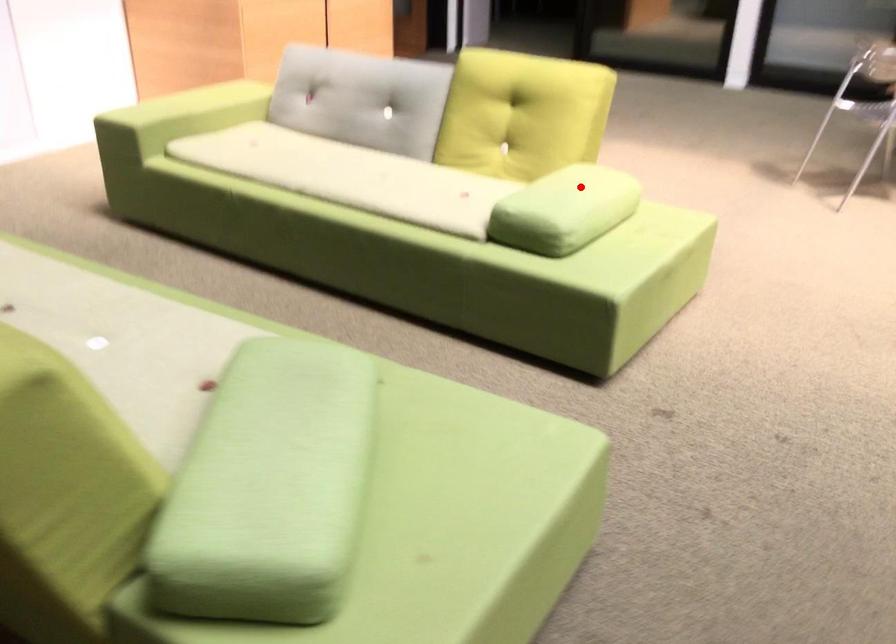
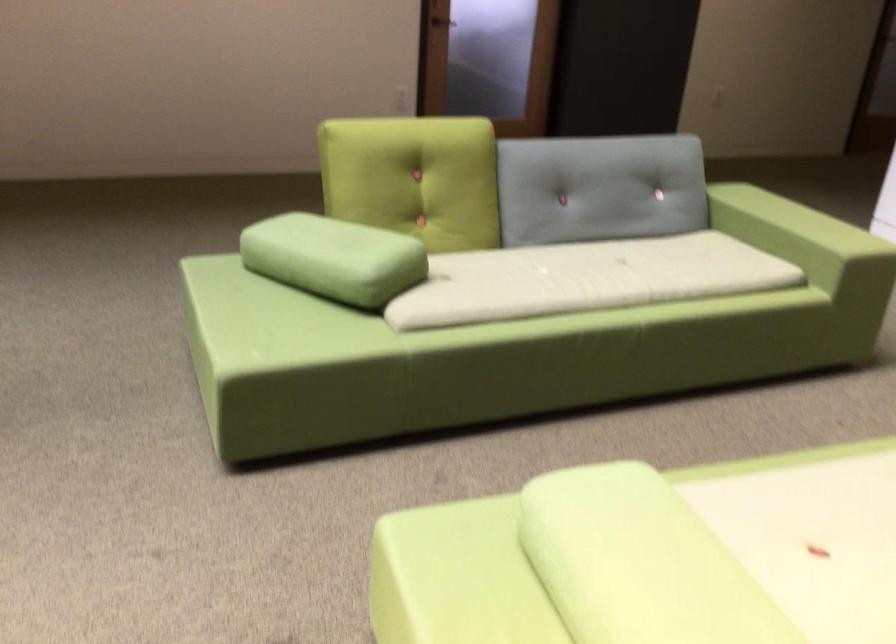
Question: I am providing you with two images of the same scene from different viewpoints. A red point is shown in image1. For the corresponding object point in image2, is it positioned nearer or farther from the camera?

Choices:
 (A) Nearer
 (B) Farther

Answer: (A)